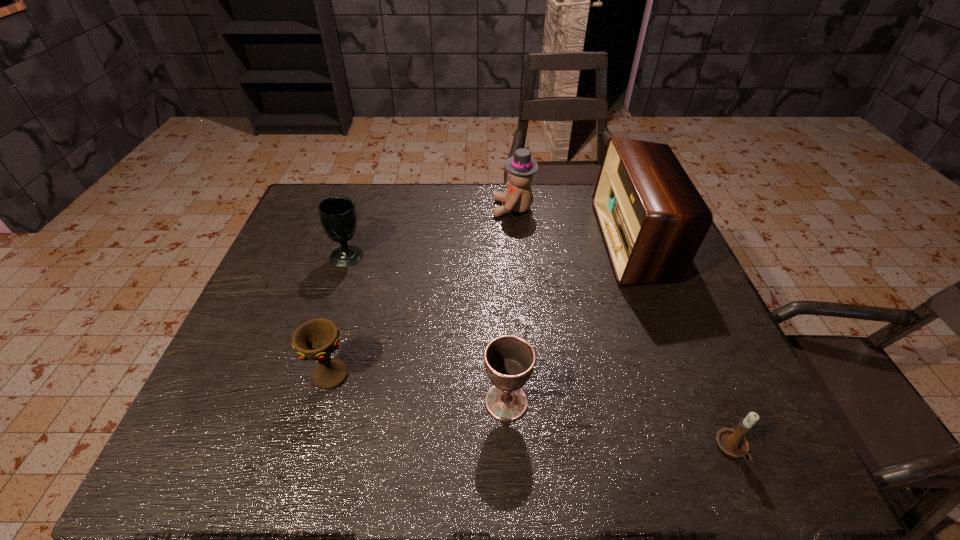
The image size is (960, 540). I want to click on free space between the rag_doll and the farthest chalice, so click(431, 232).

Select which object appears as the fourth closest to the tallest object. Please provide its 2D coordinates. Your answer should be formatted as a tuple, i.e. [(x, y)], where the tuple contains the x and y coordinates of a point satisfying the conditions above.

[(316, 339)]

The height and width of the screenshot is (540, 960). I want to click on object that is the third nearest to the radio receiver, so click(732, 442).

At what (x,y) coordinates should I click in order to perform the action: click on chalice identified as the second closest to the farthest chalice. Please return your answer as a coordinate pair (x, y). Looking at the image, I should click on (509, 360).

You are a GUI agent. You are given a task and a screenshot of the screen. Output one action in this format:
    pyautogui.click(x=<x>, y=<y>)
    Task: Click on the closest chalice to the farthest chalice
    
    Given the screenshot: What is the action you would take?
    pyautogui.click(x=316, y=339)